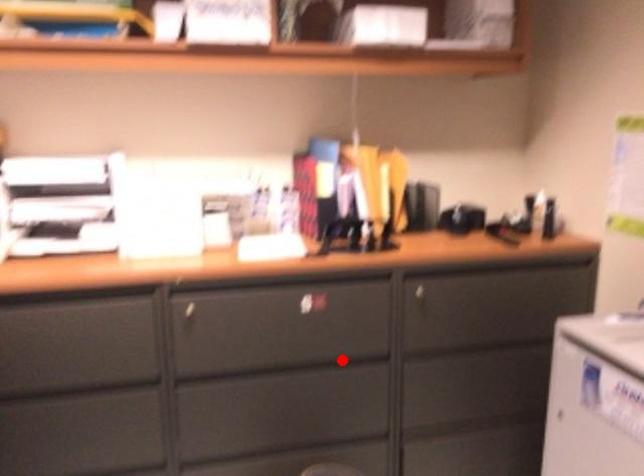
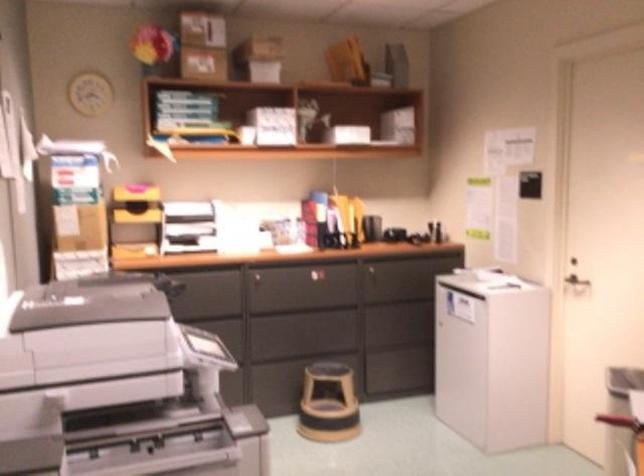
Question: I am providing you with two images of the same scene from different viewpoints. A red point is marked on the first image. Can you still see the location of the red point in image 2?

Choices:
 (A) Yes
 (B) No

Answer: (A)